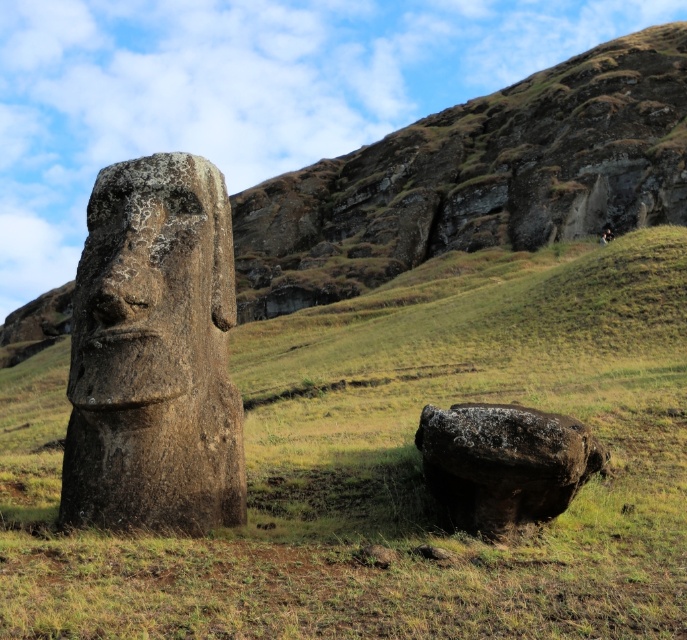
You are a drone operator tasked with capturing aerial footage of the two moai statues on Easter Island. Your drone is currently hovering above the green grassy area at center. To ensure optimal camera angles, you need to determine the exact coordinates of this grassy spot. What are the coordinates of the green grassy at center?

The coordinates of the green grassy at center are point (394, 465).